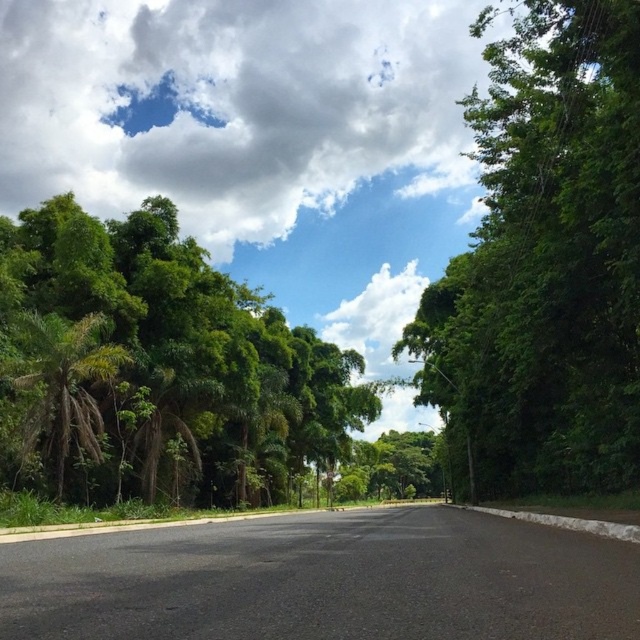
You are standing on the road and looking straight ahead. Which object is higher in the sky between the white fluffy cloud at upper center and the green leafy tree at center?

The white fluffy cloud at upper center is higher in the sky than the green leafy tree at center.

You are a landscape photographer planning to take a photo of the green leafy tree at left and the green leafy palm tree at left. Based on their widths, which tree should you focus on to capture more of its foliage in a single frame?

The green leafy tree at left has a larger width than the green leafy palm tree at left, so focusing on it will allow you to capture more of its foliage in a single frame.

Looking at this image, you are a landscape architect designing a new park and want to plant two types of trees. You have a green leafy tree at center and a green leafy palm tree at left. Which tree should you choose if you want a larger tree in the park?

The green leafy tree at center has a larger size compared to the green leafy palm tree at left, so you should choose the green leafy tree at center for a larger tree in the park.